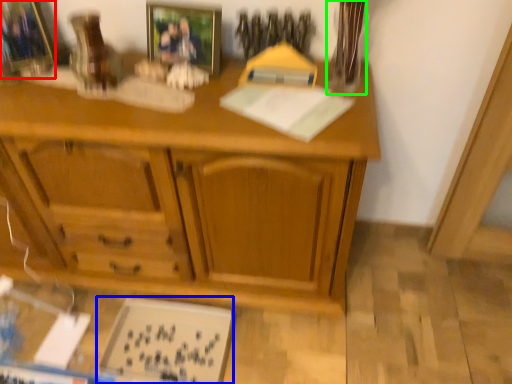
Question: Which object is the farthest from picture frame (highlighted by a red box)? Choose among these: book (highlighted by a blue box) or glass vase (highlighted by a green box).

Choices:
 (A) book
 (B) glass vase

Answer: (A)